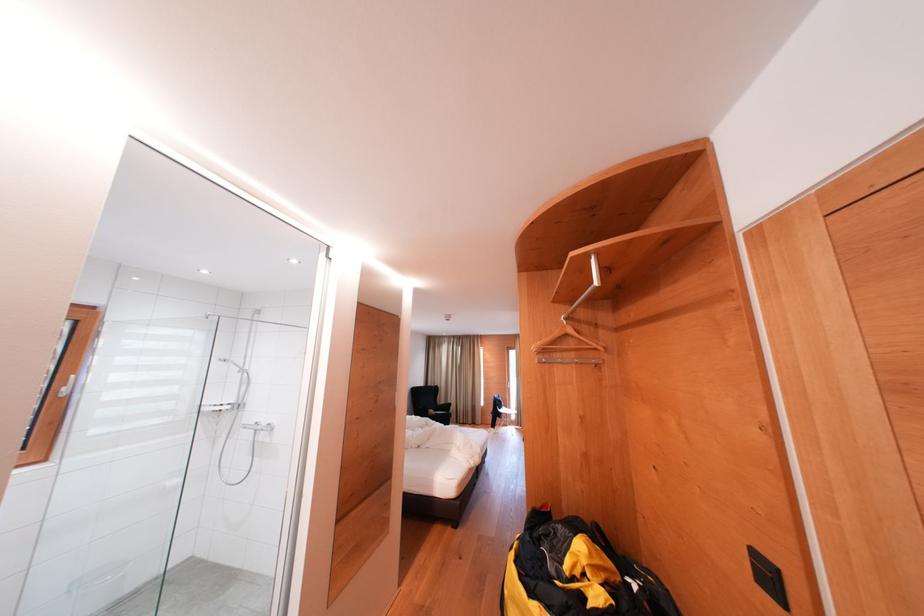
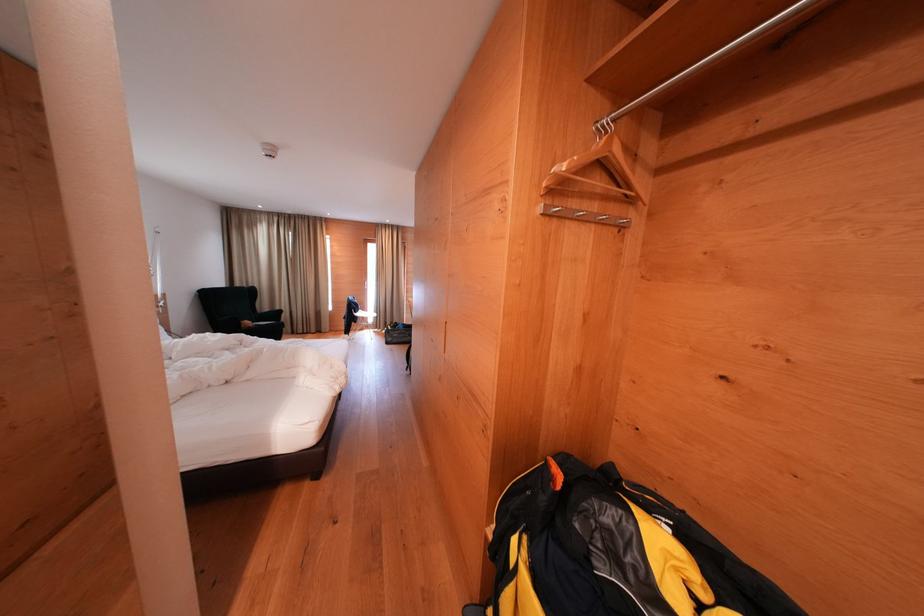
Find the pixel in the second image that matches point 556,554 in the first image.

(635, 584)